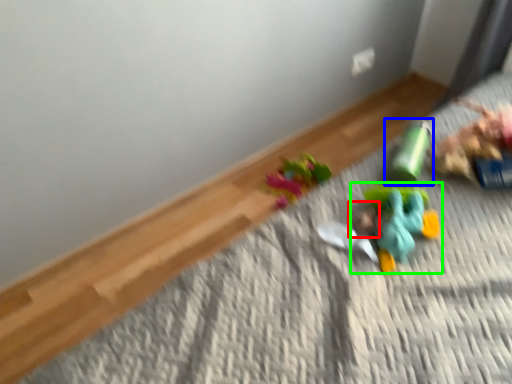
Question: Which is nearer to the head (highlighted by a red box)? toy (highlighted by a blue box) or toy (highlighted by a green box).

Choices:
 (A) toy
 (B) toy

Answer: (B)